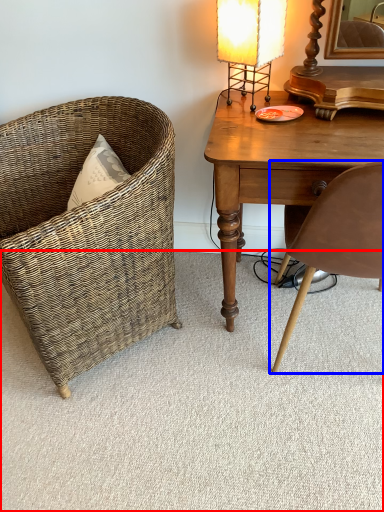
Question: Which object appears closest to the camera in this image, plain (highlighted by a red box) or chair (highlighted by a blue box)?

Choices:
 (A) plain
 (B) chair

Answer: (B)